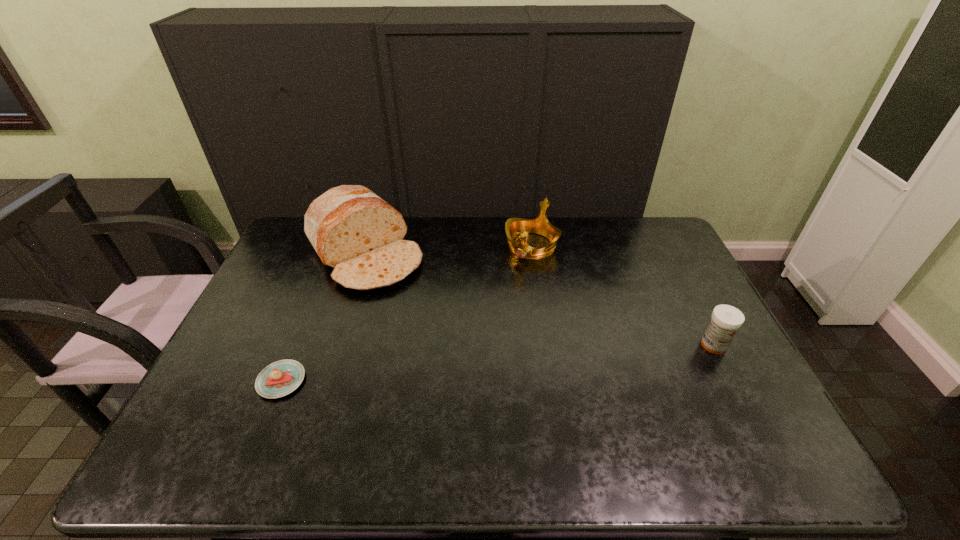
Find the location of `vacant space on the desktop that is between the nearest object and the third farthest object and is positioned at the front emblem of the second object from right to left`. vacant space on the desktop that is between the nearest object and the third farthest object and is positioned at the front emblem of the second object from right to left is located at coordinates (447, 367).

Image resolution: width=960 pixels, height=540 pixels. I want to click on vacant space on the desktop that is between the nearest object and the rightmost object and is positioned at the sliced end of the tallest object, so click(464, 366).